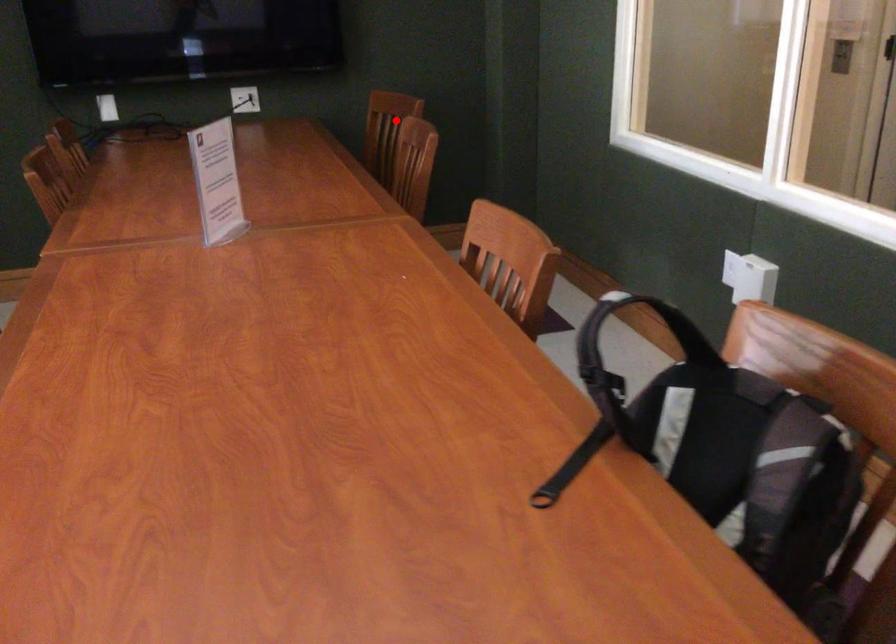
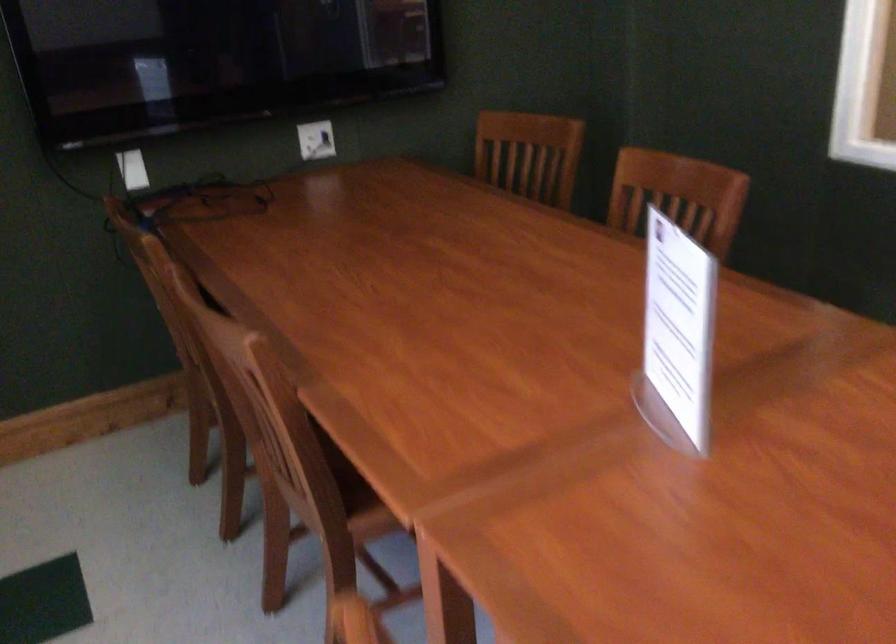
The point at the highlighted location is marked in the first image. Where is the corresponding point in the second image?

(529, 154)